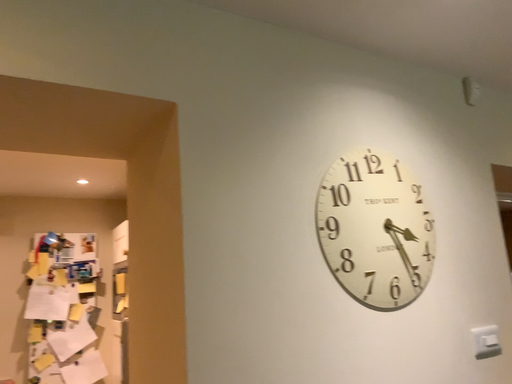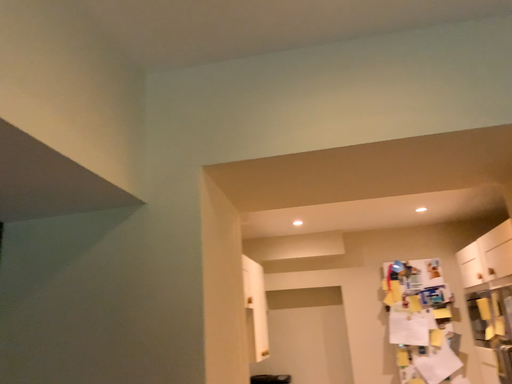
Question: Which way did the camera rotate in the video?

Choices:
 (A) rotated left
 (B) rotated right

Answer: (A)